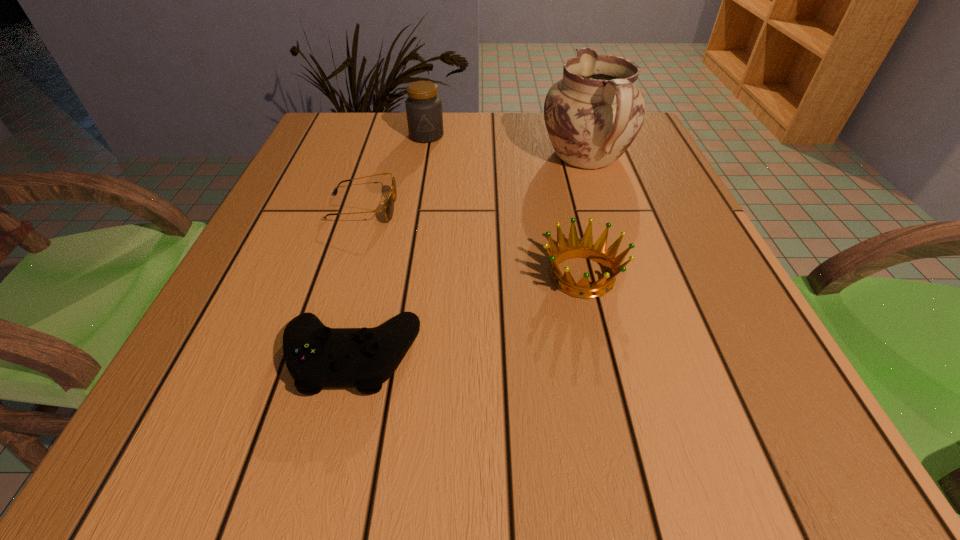
In the image, there is a desktop. At what (x,y) coordinates should I click in order to perform the action: click on vacant space at the near edge. Please return your answer as a coordinate pair (x, y). Image resolution: width=960 pixels, height=540 pixels. Looking at the image, I should click on (596, 471).

Where is `vacant space at the left edge`? The image size is (960, 540). vacant space at the left edge is located at coordinates (307, 211).

Locate an element on the screen. The width and height of the screenshot is (960, 540). free space at the right edge is located at coordinates point(658,340).

The image size is (960, 540). In the image, there is a desktop. Identify the location of vacant space at the far left corner. (359, 158).

The height and width of the screenshot is (540, 960). In the image, there is a desktop. Find the location of `vacant space at the near right corner`. vacant space at the near right corner is located at coordinates (746, 463).

This screenshot has width=960, height=540. I want to click on vacant space in between the shortest object and the second nearest object, so click(x=472, y=242).

Locate an element on the screen. The width and height of the screenshot is (960, 540). vacant area that lies between the shortest object and the nearest object is located at coordinates (357, 282).

Where is `vacant space that's between the pitcher and the shortest object`? vacant space that's between the pitcher and the shortest object is located at coordinates (474, 183).

Image resolution: width=960 pixels, height=540 pixels. I want to click on vacant space that's between the tallest object and the nearest object, so click(468, 258).

The image size is (960, 540). What are the coordinates of `free space between the third tallest object and the fourth shortest object` in the screenshot? It's located at (504, 206).